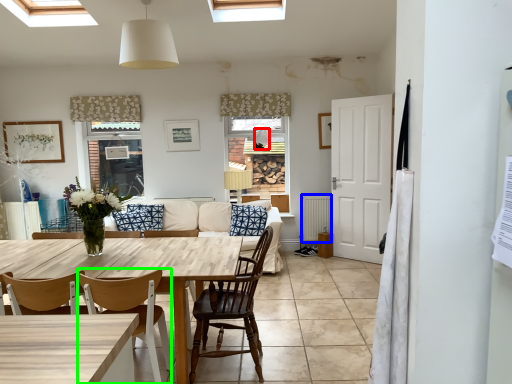
Question: Based on their relative distances, which object is nearer to lamp (highlighted by a red box)? Choose from radiator (highlighted by a blue box) and chair (highlighted by a green box).

Choices:
 (A) radiator
 (B) chair

Answer: (A)